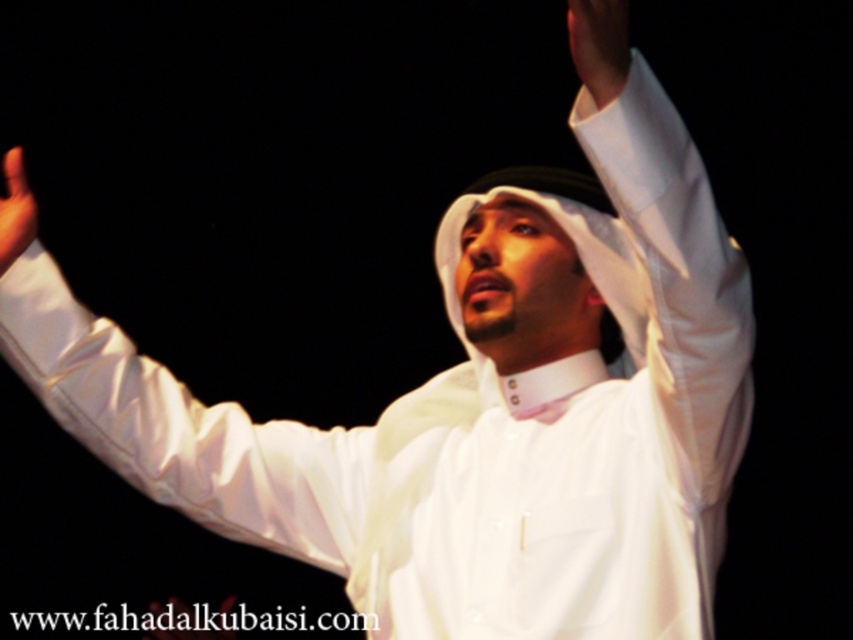
Who is lower down, white smooth hand at upper center or white matte hand at upper left?

white matte hand at upper left

Where is `white smooth hand at upper center`? Image resolution: width=853 pixels, height=640 pixels. white smooth hand at upper center is located at coordinates (599, 45).

Who is positioned more to the right, white satin arm at upper left or white satin shirt at upper center?

white satin shirt at upper center

Describe the element at coordinates (183, 429) in the screenshot. I see `white satin arm at upper left` at that location.

Describe the element at coordinates (183, 429) in the screenshot. I see `white satin arm at upper left` at that location.

Locate an element on the screen. The height and width of the screenshot is (640, 853). white satin arm at upper left is located at coordinates (183, 429).

What do you see at coordinates (183, 429) in the screenshot? I see `white satin arm at upper left` at bounding box center [183, 429].

Does point (334, 572) lie in front of point (605, 90)?

That is False.

You are a GUI agent. You are given a task and a screenshot of the screen. Output one action in this format:
    pyautogui.click(x=<x>, y=<y>)
    Task: Click on the white satin arm at upper left
    
    Given the screenshot: What is the action you would take?
    pyautogui.click(x=183, y=429)